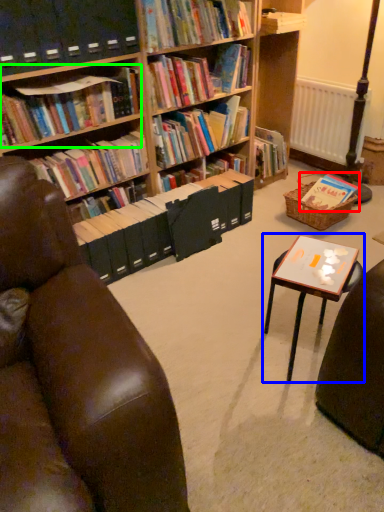
Question: Which object is the closest to the book (highlighted by a red box)? Choose among these: table (highlighted by a blue box) or book (highlighted by a green box).

Choices:
 (A) table
 (B) book

Answer: (A)